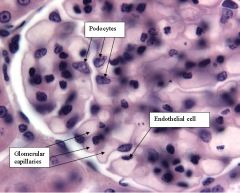
This screenshot has height=193, width=240. Find the location of `picture`. picture is located at coordinates click(114, 94).